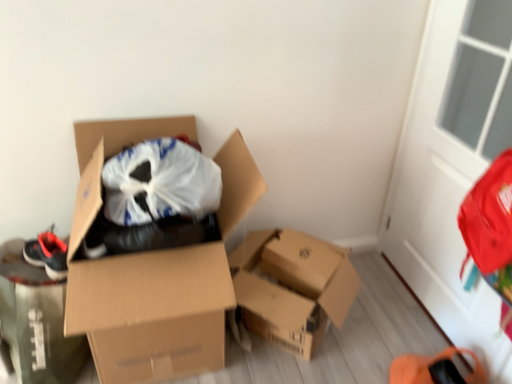
Question: Considering the relative sizes of matte black shoe at left and cardboard box at center, acting as the first box starting from the right, in the image provided, is matte black shoe at left thinner than cardboard box at center, acting as the first box starting from the right,?

Choices:
 (A) yes
 (B) no

Answer: (B)

Question: Can you confirm if matte black shoe at left is shorter than cardboard box at center, which ranks as the second box in left-to-right order?

Choices:
 (A) no
 (B) yes

Answer: (A)

Question: Does matte black shoe at left lie in front of cardboard box at center, acting as the first box starting from the right?

Choices:
 (A) no
 (B) yes

Answer: (B)

Question: From the image's perspective, is matte black shoe at left over cardboard box at center, which ranks as the second box in left-to-right order?

Choices:
 (A) no
 (B) yes

Answer: (B)

Question: Is matte black shoe at left completely or partially outside of cardboard box at center, which ranks as the second box in left-to-right order?

Choices:
 (A) yes
 (B) no

Answer: (A)

Question: Is cardboard box at center, which ranks as the second box in left-to-right order, inside or outside of cardboard box at center, the second box from the right?

Choices:
 (A) outside
 (B) inside

Answer: (A)

Question: In terms of size, does cardboard box at center, which ranks as the second box in left-to-right order, appear bigger or smaller than cardboard box at center, the second box from the right?

Choices:
 (A) big
 (B) small

Answer: (B)

Question: Visually, is cardboard box at center, acting as the first box starting from the right, positioned to the left or to the right of cardboard box at center, the second box from the right?

Choices:
 (A) right
 (B) left

Answer: (A)

Question: From the image's perspective, is cardboard box at center, acting as the first box starting from the right, above or below cardboard box at center, the second box from the right?

Choices:
 (A) below
 (B) above

Answer: (A)

Question: In the image, is matte black shoe at left on the left side or the right side of cardboard box at center, acting as the first box starting from the right?

Choices:
 (A) left
 (B) right

Answer: (A)

Question: Is matte black shoe at left taller or shorter than cardboard box at center, which ranks as the second box in left-to-right order?

Choices:
 (A) tall
 (B) short

Answer: (A)

Question: From a real-world perspective, is matte black shoe at left positioned above or below cardboard box at center, acting as the first box starting from the right?

Choices:
 (A) below
 (B) above

Answer: (B)

Question: From the image's perspective, is matte black shoe at left located above or below cardboard box at center, acting as the first box starting from the right?

Choices:
 (A) above
 (B) below

Answer: (A)

Question: Considering the positions of cardboard box at center, the second box from the right, and cardboard box at center, which ranks as the second box in left-to-right order, in the image, is cardboard box at center, the second box from the right, wider or thinner than cardboard box at center, which ranks as the second box in left-to-right order,?

Choices:
 (A) wide
 (B) thin

Answer: (A)

Question: Considering the positions of point (88, 122) and point (314, 342), is point (88, 122) closer or farther from the camera than point (314, 342)?

Choices:
 (A) closer
 (B) farther

Answer: (A)